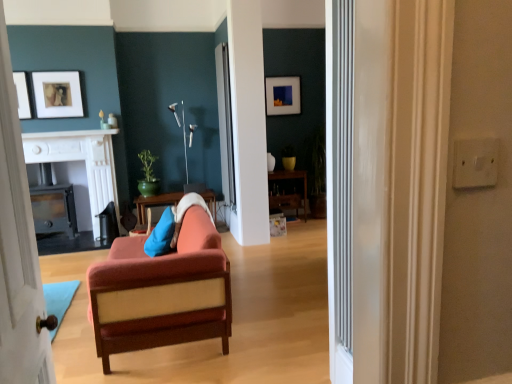
This screenshot has height=384, width=512. In order to click on white glossy fireplace at left in this screenshot , I will do `click(79, 160)`.

The image size is (512, 384). Describe the element at coordinates (225, 126) in the screenshot. I see `clear glass door at center` at that location.

Describe the element at coordinates (283, 95) in the screenshot. This screenshot has height=384, width=512. I see `matte black picture frame at upper center, which is counted as the first picture frame, starting from the back` at that location.

At what (x,y) coordinates should I click in order to perform the action: click on matte black picture frame at upper center, which is counted as the first picture frame, starting from the back. Please return your answer as a coordinate pair (x, y). Looking at the image, I should click on (283, 95).

I want to click on matte white picture frame at upper left, which is the second picture frame in left-to-right order, so click(x=57, y=94).

What are the coordinates of `blue fabric pillow at center` in the screenshot? It's located at (161, 235).

Where is `white glossy fireplace at left`? Image resolution: width=512 pixels, height=384 pixels. white glossy fireplace at left is located at coordinates (79, 160).

The height and width of the screenshot is (384, 512). Find the location of `studio couch located underneath the clear glass door at center (from a real-world perspective)`. studio couch located underneath the clear glass door at center (from a real-world perspective) is located at coordinates (162, 292).

Which of these two, clear glass door at center or velvet orange couch at center, is wider?

velvet orange couch at center.

Is clear glass door at center shorter than velvet orange couch at center?

No, clear glass door at center is not shorter than velvet orange couch at center.

Choose the correct answer: Is clear glass door at center inside velvet orange couch at center or outside it?

clear glass door at center exists outside the volume of velvet orange couch at center.

Is wooden cabinet at center, which is the 1th table in right-to-left order, looking in the opposite direction of matte white picture frame at upper left, marked as the 2th picture frame in a right-to-left arrangement?

No, wooden cabinet at center, which is the 1th table in right-to-left order, is not facing the opposite direction of matte white picture frame at upper left, marked as the 2th picture frame in a right-to-left arrangement.

From the image's perspective, does wooden cabinet at center, arranged as the 2th table when viewed from the left, appear lower than matte white picture frame at upper left, which is the second picture frame in left-to-right order?

Yes, from the image's perspective, wooden cabinet at center, arranged as the 2th table when viewed from the left, is below matte white picture frame at upper left, which is the second picture frame in left-to-right order.

Can you tell me how much wooden cabinet at center, which is the 1th table in right-to-left order, and matte white picture frame at upper left, marked as the 2th picture frame in a right-to-left arrangement, differ in facing direction?

wooden cabinet at center, which is the 1th table in right-to-left order, and matte white picture frame at upper left, marked as the 2th picture frame in a right-to-left arrangement, are facing 0.00243 degrees away from each other.

Can you confirm if matte white picture frame at upper left, positioned as the 3th picture frame in right-to-left order, is wider than white painted wood door at left?

No.

Between matte white picture frame at upper left, positioned as the 3th picture frame in right-to-left order, and white painted wood door at left, which one is positioned behind?

Positioned behind is matte white picture frame at upper left, positioned as the 3th picture frame in right-to-left order.

From a real-world perspective, between matte white picture frame at upper left, positioned as the 3th picture frame in right-to-left order, and white painted wood door at left, who is vertically lower?

white painted wood door at left is physically lower.

Looking at this image, is matte white picture frame at upper left, which appears as the 3th picture frame when viewed from the back, positioned with its back to white painted wood door at left?

No, matte white picture frame at upper left, which appears as the 3th picture frame when viewed from the back, is not facing away from white painted wood door at left.

From the image's perspective, which picture frame is the 1st one above the wooden cabinet at center, which is the 1th table in right-to-left order? Please provide its 2D coordinates.

[(22, 94)]

Are matte white picture frame at upper left, positioned as the 1th picture frame in front-to-back order, and wooden cabinet at center, which is the 1th table in right-to-left order, beside each other?

No, matte white picture frame at upper left, positioned as the 1th picture frame in front-to-back order, is not touching wooden cabinet at center, which is the 1th table in right-to-left order.

From a real-world perspective, is matte white picture frame at upper left, positioned as the 3th picture frame in right-to-left order, beneath wooden cabinet at center, arranged as the 2th table when viewed from the left?

No, from a real-world perspective, matte white picture frame at upper left, positioned as the 3th picture frame in right-to-left order, is not below wooden cabinet at center, arranged as the 2th table when viewed from the left.

Is the depth of matte white picture frame at upper left, positioned as the 3th picture frame in right-to-left order, greater than that of wooden cabinet at center, which is the 1th table in right-to-left order?

No, matte white picture frame at upper left, positioned as the 3th picture frame in right-to-left order, is closer to the viewer.

Who is taller, wooden cabinet at center, arranged as the 2th table when viewed from the left, or matte black picture frame at upper center, which appears as the 3th picture frame when viewed from the front?

wooden cabinet at center, arranged as the 2th table when viewed from the left, is taller.

From the image's perspective, is wooden cabinet at center, arranged as the 2th table when viewed from the left, above matte black picture frame at upper center, positioned as the 1th picture frame in right-to-left order?

No, from the image's perspective, wooden cabinet at center, arranged as the 2th table when viewed from the left, is not on top of matte black picture frame at upper center, positioned as the 1th picture frame in right-to-left order.

Can you confirm if wooden cabinet at center, which is the 1th table in right-to-left order, is bigger than matte black picture frame at upper center, which appears as the 3th picture frame when viewed from the front?

Indeed, wooden cabinet at center, which is the 1th table in right-to-left order, has a larger size compared to matte black picture frame at upper center, which appears as the 3th picture frame when viewed from the front.

Is wooden cabinet at center, which is the 1th table in right-to-left order, oriented towards matte black picture frame at upper center, marked as the 3th picture frame in a left-to-right arrangement?

No.

From a real-world perspective, who is located lower, white painted wood door at left or blue fabric pillow at center?

From a 3D spatial view, blue fabric pillow at center is below.

Is blue fabric pillow at center at the back of white painted wood door at left?

No, white painted wood door at left is not facing the opposite direction of blue fabric pillow at center.

Is white painted wood door at left not close to blue fabric pillow at center?

Yes, white painted wood door at left and blue fabric pillow at center are quite far apart.

Find the location of a particular element. Image resolution: width=512 pixels, height=384 pixels. pillow below the white painted wood door at left (from the image's perspective) is located at coordinates (161, 235).

How far apart are wooden cabinet at center, which is the 1th table in right-to-left order, and velvet orange couch at center?

They are 3.86 meters apart.

From the image's perspective, is wooden cabinet at center, which is the 1th table in right-to-left order, above or below velvet orange couch at center?

wooden cabinet at center, which is the 1th table in right-to-left order, is above velvet orange couch at center.

Is wooden cabinet at center, which is the 1th table in right-to-left order, in front of or behind velvet orange couch at center in the image?

Visually, wooden cabinet at center, which is the 1th table in right-to-left order, is located behind velvet orange couch at center.

From a real-world perspective, which object rests below the other?

wooden cabinet at center, arranged as the 2th table when viewed from the left, from a real-world perspective.

At what (x,y) coordinates should I click in order to perform the action: click on glass door behind the velvet orange couch at center. Please return your answer as a coordinate pair (x, y). Image resolution: width=512 pixels, height=384 pixels. Looking at the image, I should click on (225, 126).

From the image's perspective, starting from the matte white picture frame at upper left, the 2th picture frame when ordered from front to back, which table is the 1st one below? Please provide its 2D coordinates.

[(289, 192)]

Based on the photo, estimate the real-world distances between objects in this image. Which object is closer to velvet orange couch at center, white glossy fireplace at left or matte white picture frame at upper left, which appears as the 3th picture frame when viewed from the back?

Among the two, white glossy fireplace at left is located nearer to velvet orange couch at center.

From the image, which object appears to be farther from matte black picture frame at upper center, positioned as the 1th picture frame in right-to-left order, metallic silver lamp at upper center or white painted wood door at left?

The object further to matte black picture frame at upper center, positioned as the 1th picture frame in right-to-left order, is white painted wood door at left.

Which object lies further to the anchor point clear glass door at center, metallic silver lamp at upper center or white glossy fireplace at left?

white glossy fireplace at left.

From the image, which object appears to be farther from wooden table at center, placed as the 2th table when sorted from right to left, white painted wood door at left or white glossy fireplace at upper center?

white painted wood door at left lies further to wooden table at center, placed as the 2th table when sorted from right to left, than the other object.

Which object lies further to the anchor point clear glass door at center, white painted wood door at left or metallic silver lamp at upper center?

Based on the image, white painted wood door at left appears to be further to clear glass door at center.

Looking at this image, which object lies further to the anchor point matte white picture frame at upper left, which appears as the 3th picture frame when viewed from the back, white glossy fireplace at left or wooden table at center, the first table from the left?

Based on the image, wooden table at center, the first table from the left, appears to be further to matte white picture frame at upper left, which appears as the 3th picture frame when viewed from the back.

Based on their spatial positions, is white glossy fireplace at upper center or matte black picture frame at upper center, positioned as the 1th picture frame in right-to-left order, closer to white painted wood door at left?

Based on the image, white glossy fireplace at upper center appears to be nearer to white painted wood door at left.

Which object lies nearer to the anchor point metallic silver lamp at upper center, white glossy fireplace at left or velvet orange couch at center?

Based on the image, white glossy fireplace at left appears to be nearer to metallic silver lamp at upper center.

Find the location of a particular element. mantle between white painted wood door at left and clear glass door at center from front to back is located at coordinates (69, 134).

This screenshot has width=512, height=384. Identify the location of pillow between white glossy fireplace at upper center and wooden cabinet at center, arranged as the 2th table when viewed from the left, in the horizontal direction. (161, 235).

I want to click on studio couch positioned between white painted wood door at left and metallic silver lamp at upper center from near to far, so click(x=162, y=292).

Identify the location of fireplace between velvet orange couch at center and wooden table at center, the first table from the left, in the front-back direction. (79, 160).